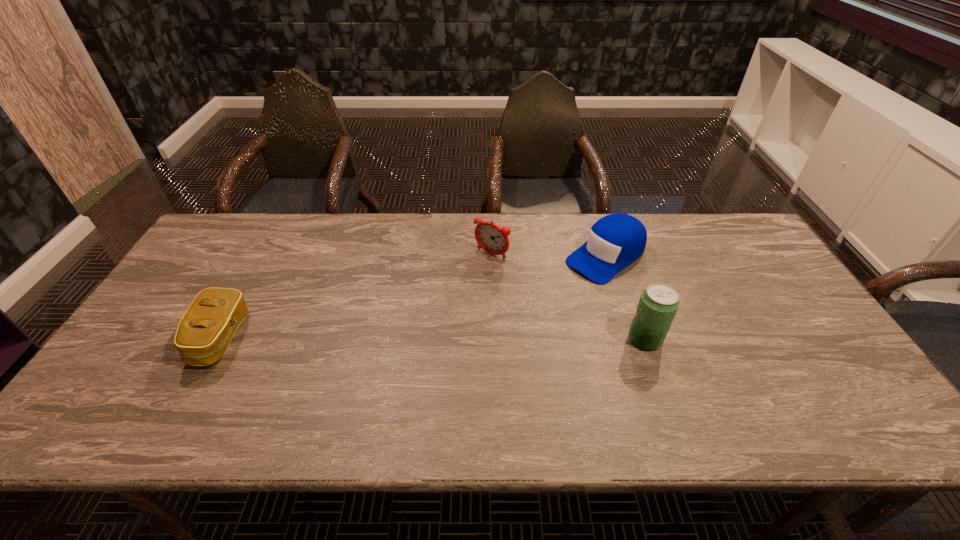
In the image, there is a desktop. Where is `blank space at the near edge`? This screenshot has height=540, width=960. blank space at the near edge is located at coordinates (630, 376).

Where is `vacant space at the left edge of the desktop`? vacant space at the left edge of the desktop is located at coordinates (151, 350).

In order to click on vacant space at the far left corner of the desktop in this screenshot , I will do `click(251, 229)`.

I want to click on empty space that is in between the soda and the leftmost object, so click(433, 339).

This screenshot has height=540, width=960. What are the coordinates of `blank region between the alarm clock and the tallest object` in the screenshot? It's located at (568, 296).

The height and width of the screenshot is (540, 960). I want to click on unoccupied position between the baseball cap and the leftmost object, so click(x=413, y=298).

The width and height of the screenshot is (960, 540). What are the coordinates of `vacant space that's between the third object from right to left and the baseball cap` in the screenshot? It's located at (548, 255).

The height and width of the screenshot is (540, 960). Find the location of `free spot between the baseball cap and the third object from right to left`. free spot between the baseball cap and the third object from right to left is located at coordinates (548, 255).

In order to click on empty space between the soda and the clutch bag in this screenshot , I will do `click(433, 339)`.

I want to click on vacant area that lies between the alarm clock and the clutch bag, so click(x=356, y=296).